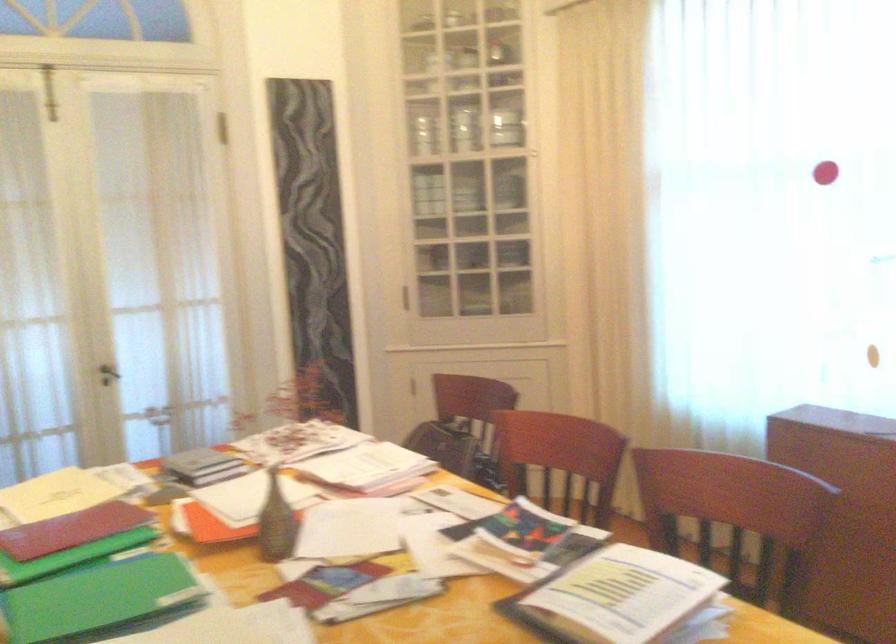
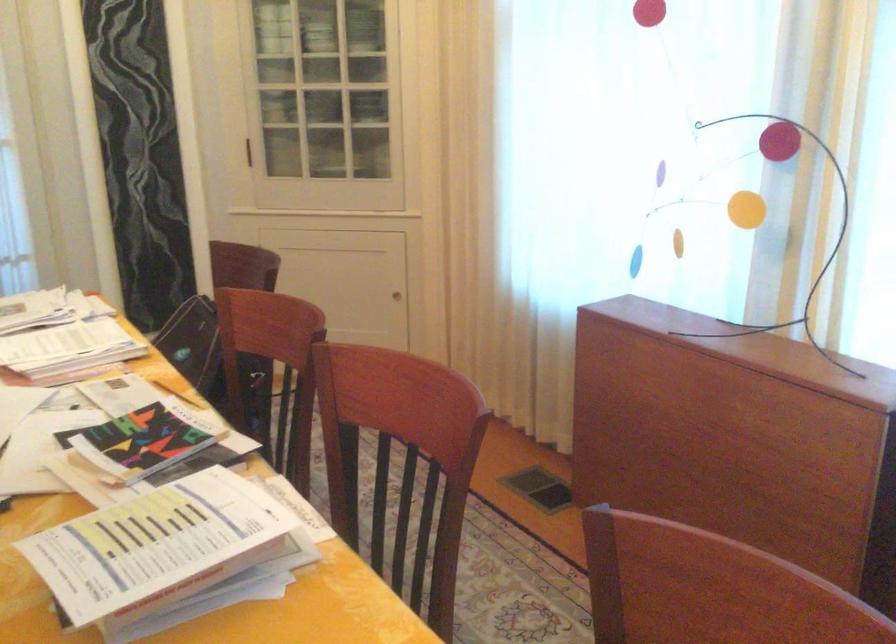
Question: The images are taken continuously from a first-person perspective. In which direction is your viewpoint rotating?

Choices:
 (A) Left
 (B) Right
 (C) Up
 (D) Down

Answer: (D)